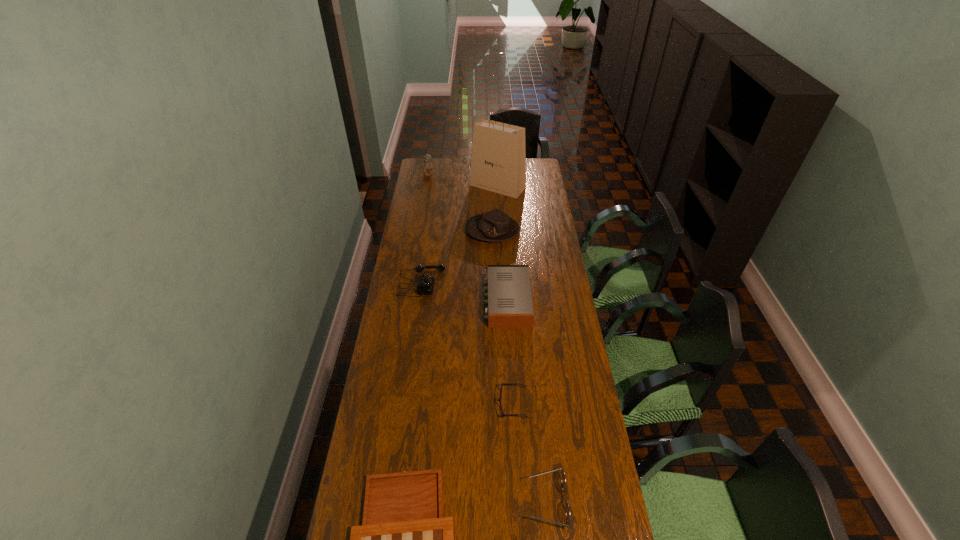
The height and width of the screenshot is (540, 960). In order to click on vacant space located 0.140m on the front-facing side of the taller spectacles in this screenshot , I will do `click(477, 501)`.

The height and width of the screenshot is (540, 960). Find the location of `vacant point located on the front-facing side of the taller spectacles`. vacant point located on the front-facing side of the taller spectacles is located at coordinates (442, 501).

Identify the location of vacant area situated on the front-facing side of the third nearest object. (394, 404).

At what (x,y) coordinates should I click in order to perform the action: click on free space located on the front-facing side of the third nearest object. Please return your answer as a coordinate pair (x, y). The height and width of the screenshot is (540, 960). Looking at the image, I should click on (412, 404).

Identify the location of vacant area located on the front-facing side of the third nearest object. (418, 404).

This screenshot has width=960, height=540. I want to click on shopping bag at the far edge, so [x=498, y=164].

You are a GUI agent. You are given a task and a screenshot of the screen. Output one action in this format:
    pyautogui.click(x=<x>, y=<y>)
    Task: Click on the teddy bear at the far edge
    
    Given the screenshot: What is the action you would take?
    pyautogui.click(x=426, y=166)

This screenshot has width=960, height=540. I want to click on teddy bear present at the left edge, so click(426, 166).

This screenshot has width=960, height=540. I want to click on telephone that is at the left edge, so click(425, 285).

I want to click on shopping bag positioned at the right edge, so click(x=498, y=164).